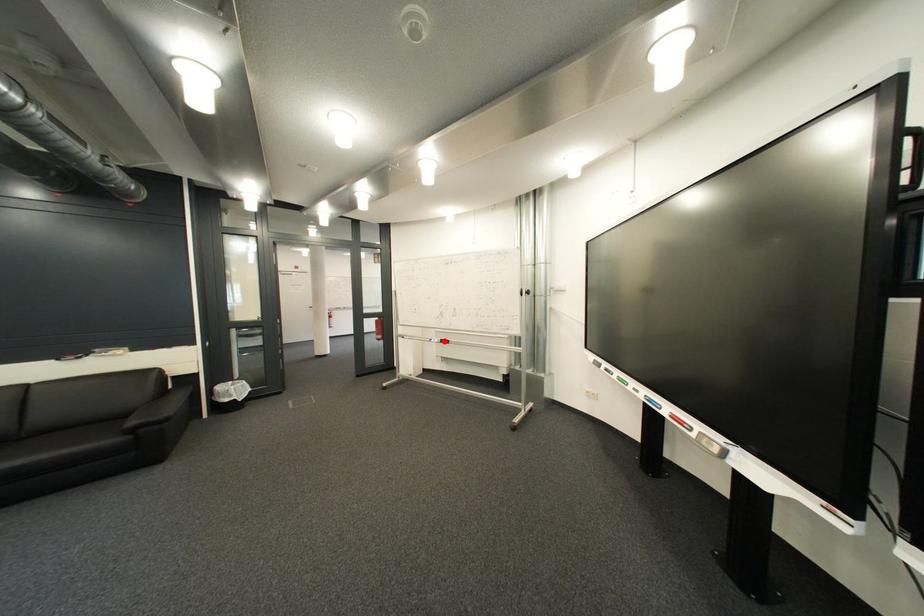
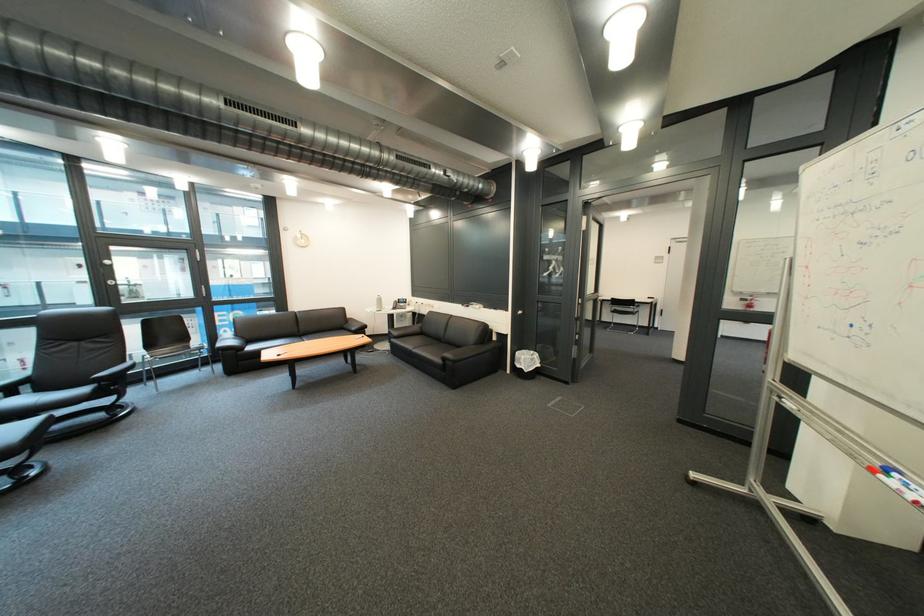
Question: I am providing you with two images of the same scene from different viewpoints. Image1 has a red point marked. In image2, the corresponding 3D location appears at what relative position? Reply with the corresponding letter.

Choices:
 (A) Closer
 (B) Farther

Answer: (B)